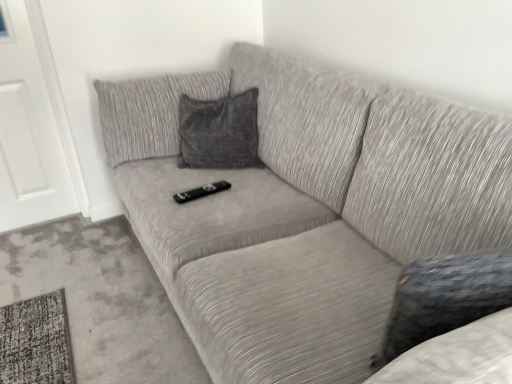
Question: From their relative heights in the image, would you say textured gray couch at center is taller or shorter than white matte door at left?

Choices:
 (A) short
 (B) tall

Answer: (A)

Question: Considering the positions of textured gray couch at center and white matte door at left in the image, is textured gray couch at center bigger or smaller than white matte door at left?

Choices:
 (A) big
 (B) small

Answer: (A)

Question: Which of these objects is positioned farthest from the white matte door at left?

Choices:
 (A) black plastic remote at center
 (B) textured gray couch at center

Answer: (A)

Question: Which object is the closest to the textured gray couch at center?

Choices:
 (A) white matte door at left
 (B) black plastic remote at center

Answer: (B)